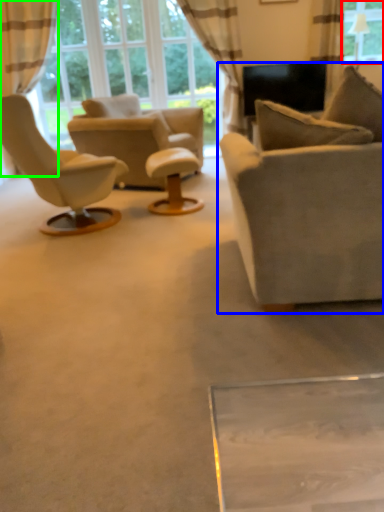
Question: Which object is positioned closest to window (highlighted by a red box)? Select from studio couch (highlighted by a blue box) and curtain (highlighted by a green box).

Choices:
 (A) studio couch
 (B) curtain

Answer: (A)